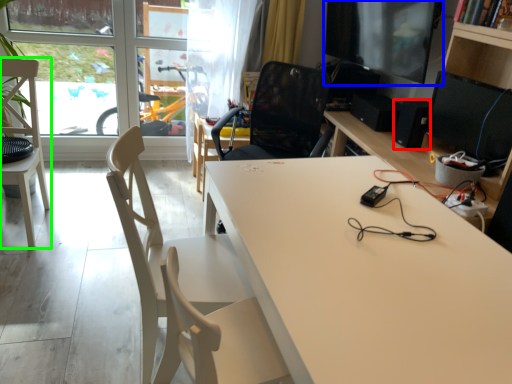
Question: Which is nearer to the speaker (highlighted by a red box)? computer monitor (highlighted by a blue box) or chair (highlighted by a green box).

Choices:
 (A) computer monitor
 (B) chair

Answer: (A)